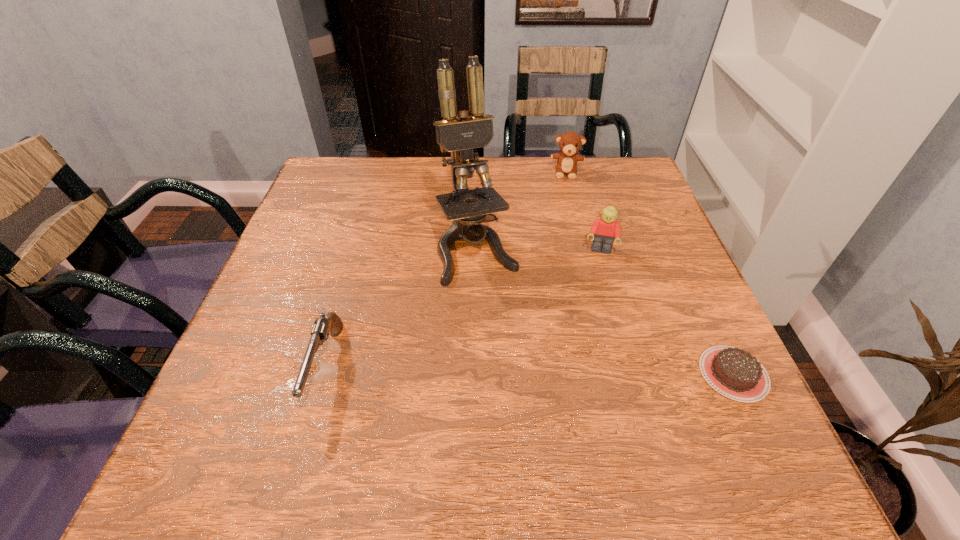
The image size is (960, 540). Find the location of `free space at the far right corner`. free space at the far right corner is located at coordinates (620, 170).

The height and width of the screenshot is (540, 960). Identify the location of vacant region at the near right corner of the desktop. (701, 387).

Find the location of a particular element. vacant space that is in between the leftmost object and the Lego is located at coordinates (463, 309).

The width and height of the screenshot is (960, 540). In order to click on empty space that is in between the leftmost object and the Lego in this screenshot , I will do `click(463, 309)`.

Identify the location of free space between the rightmost object and the fourth object from right to left. (606, 312).

Identify the location of vacant space in between the tallest object and the gun. (401, 308).

Where is `vacant region between the second object from left to right and the farthest object`? Image resolution: width=960 pixels, height=540 pixels. vacant region between the second object from left to right and the farthest object is located at coordinates (522, 212).

Image resolution: width=960 pixels, height=540 pixels. Identify the location of empty location between the chocolate cake and the Lego. (666, 313).

You are a GUI agent. You are given a task and a screenshot of the screen. Output one action in this format:
    pyautogui.click(x=<x>, y=<y>)
    Task: Click on the vacant area between the shortest object and the second object from left to right
    The width and height of the screenshot is (960, 540).
    Given the screenshot: What is the action you would take?
    pyautogui.click(x=606, y=312)

Locate an element on the screen. vacant area that lies between the gun and the chocolate cake is located at coordinates (x=530, y=370).